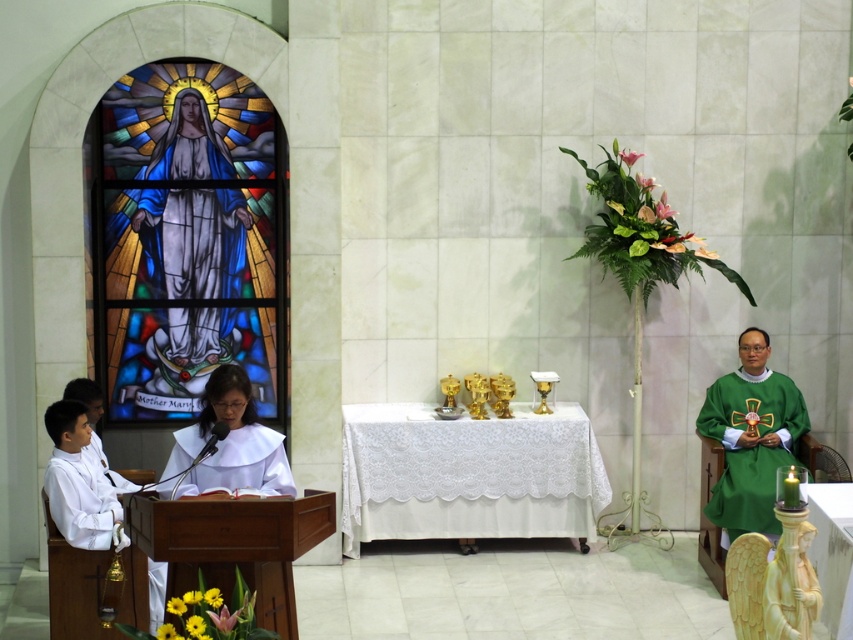
You are an attendee at the religious service and want to know who is closer to the altar. Which figure is shorter between the white clothed figure at center and the white matte robe at left?

The white clothed figure at center is shorter than the white matte robe at left, so the shorter figure is closer to the altar.

You are a visitor in the church and want to place a bouquet of flowers between the translucent glass robe at upper left and the green satin robe at right. The bouquet requires 2 meters of space. Is there enough space between them?

The translucent glass robe at upper left and green satin robe at right are 3.11 meters apart from each other, so yes, there is enough space to place the bouquet between them since the required 2 meters is less than the available distance.